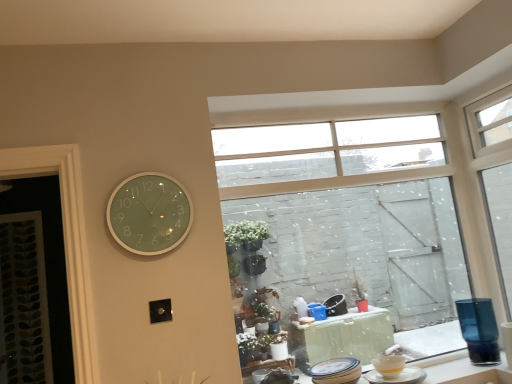
Question: Can you confirm if yellow matte bowl at lower right, placed as the second tableware when sorted from right to left, is shorter than clear glass window at upper center, which is the second window in right-to-left order?

Choices:
 (A) no
 (B) yes

Answer: (B)

Question: Does yellow matte bowl at lower right, placed as the second tableware when sorted from right to left, turn towards clear glass window at upper center, which is the second window in right-to-left order?

Choices:
 (A) yes
 (B) no

Answer: (B)

Question: Can you confirm if yellow matte bowl at lower right, marked as the second tableware in a left-to-right arrangement, is taller than clear glass window at upper center, which is the second window in right-to-left order?

Choices:
 (A) no
 (B) yes

Answer: (A)

Question: Considering the relative positions of yellow matte bowl at lower right, placed as the second tableware when sorted from right to left, and clear glass window at upper center, which is the second window in right-to-left order, in the image provided, is yellow matte bowl at lower right, placed as the second tableware when sorted from right to left, to the right of clear glass window at upper center, which is the second window in right-to-left order, from the viewer's perspective?

Choices:
 (A) yes
 (B) no

Answer: (A)

Question: From a real-world perspective, is yellow matte bowl at lower right, marked as the second tableware in a left-to-right arrangement, physically below clear glass window at upper center, which appears as the 1th window when viewed from the left?

Choices:
 (A) no
 (B) yes

Answer: (B)

Question: In terms of width, does clear glass window at upper center, which appears as the 1th window when viewed from the left, look wider or thinner when compared to green glass clock at upper left?

Choices:
 (A) thin
 (B) wide

Answer: (B)

Question: Considering the positions of clear glass window at upper center, which is the second window in right-to-left order, and green glass clock at upper left in the image, is clear glass window at upper center, which is the second window in right-to-left order, taller or shorter than green glass clock at upper left?

Choices:
 (A) tall
 (B) short

Answer: (A)

Question: Is point (444, 215) positioned closer to the camera than point (133, 246)?

Choices:
 (A) closer
 (B) farther

Answer: (B)

Question: From a real-world perspective, relative to green glass clock at upper left, is clear glass window at upper center, which is the second window in right-to-left order, vertically above or below?

Choices:
 (A) below
 (B) above

Answer: (A)

Question: From a real-world perspective, is white ceramic plate at lower right, the first tableware in the left-to-right sequence, above or below yellow matte bowl at lower right, marked as the second tableware in a left-to-right arrangement?

Choices:
 (A) above
 (B) below

Answer: (A)

Question: Does point (339, 357) appear closer or farther from the camera than point (395, 372)?

Choices:
 (A) closer
 (B) farther

Answer: (B)

Question: Based on their positions, is white ceramic plate at lower right, placed as the 3th tableware when sorted from right to left, located to the left or right of yellow matte bowl at lower right, placed as the second tableware when sorted from right to left?

Choices:
 (A) right
 (B) left

Answer: (B)

Question: Which is correct: white ceramic plate at lower right, placed as the 3th tableware when sorted from right to left, is inside yellow matte bowl at lower right, marked as the second tableware in a left-to-right arrangement, or outside of it?

Choices:
 (A) outside
 (B) inside

Answer: (A)

Question: Looking at the image, does green glass clock at upper left seem bigger or smaller compared to clear glass window at upper right, the second window from the left?

Choices:
 (A) big
 (B) small

Answer: (B)

Question: From the image's perspective, relative to clear glass window at upper right, the 1th window viewed from the right, is green glass clock at upper left above or below?

Choices:
 (A) above
 (B) below

Answer: (A)